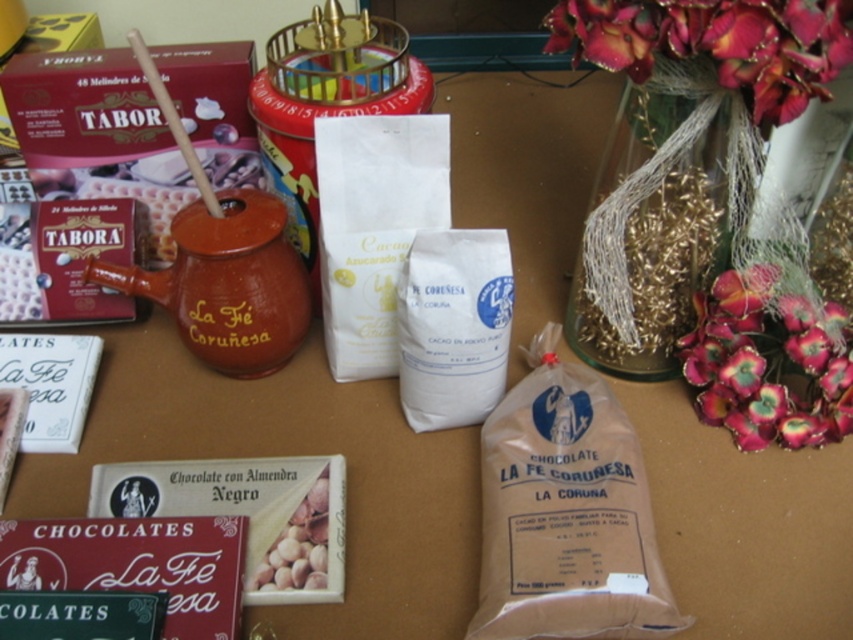
You are at a table with items arranged as described. There is a point marked at coordinates (566, 513). What object is located at this point?

The point at coordinates (566, 513) marks the brown paper bag at center.

You are arranging flowers for a birthday party and need to place the silky pink petals at upper right and the brown matte chocolate bar at center on a table. Which object should you place first to ensure they both fit on the table?

The silky pink petals at upper right is much taller than the brown matte chocolate bar at center, so you should place the taller silky pink petals at upper right first to ensure they both fit on the table.

You are organizing items on a table and need to place the brown paper bag at center and silky pink petals at upper right. Which object requires more space due to its size?

The brown paper bag at center requires more space because it is bigger than the silky pink petals at upper right.